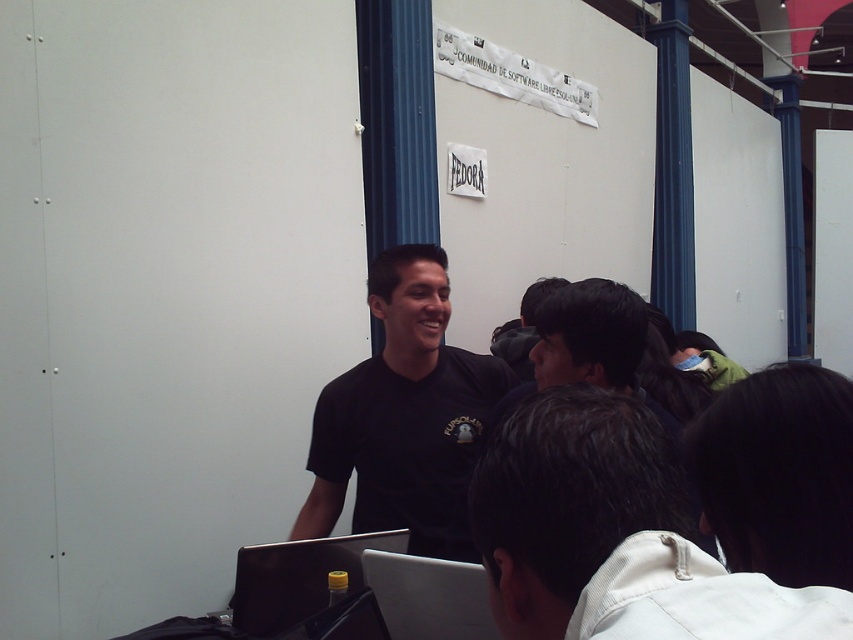
Where is the black hair at lower right located in the image?

The black hair at lower right is located at point (779,474) in the image.

You are a photographer in the conference room and want to take a photo of the black hair at lower right and the silver metallic laptop at lower left. Which object is located to the right side of the other?

The black hair at lower right is positioned on the right side of silver metallic laptop at lower left.

You are a photographer in the conference room. You want to take a photo of the silver metallic laptop at lower left without including the white corduroy jacket at lower right in the frame. Is this possible based on their positions?

The white corduroy jacket at lower right is above the silver metallic laptop at lower left. Therefore, to avoid including the jacket, you can position the camera lower to focus solely on the laptop without the jacket appearing in the frame.